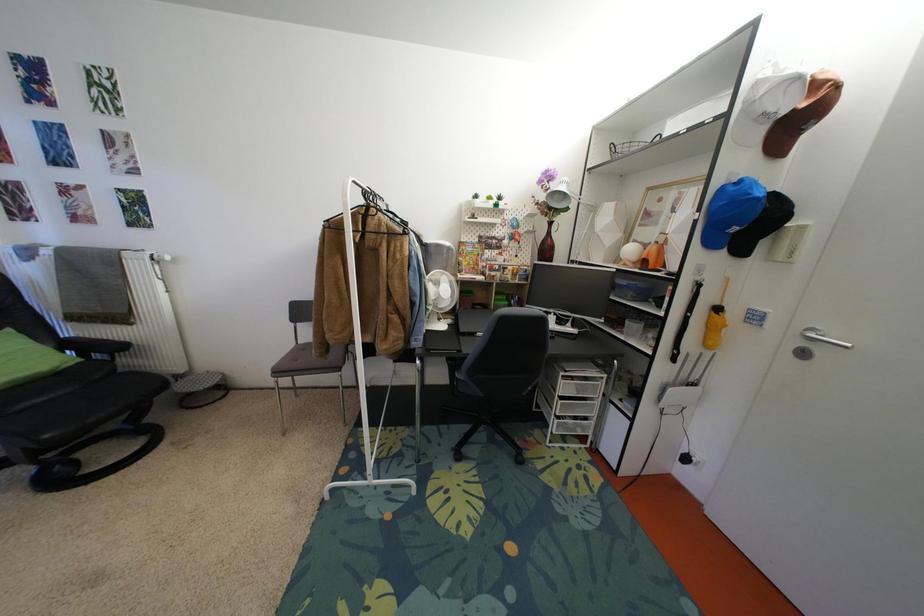
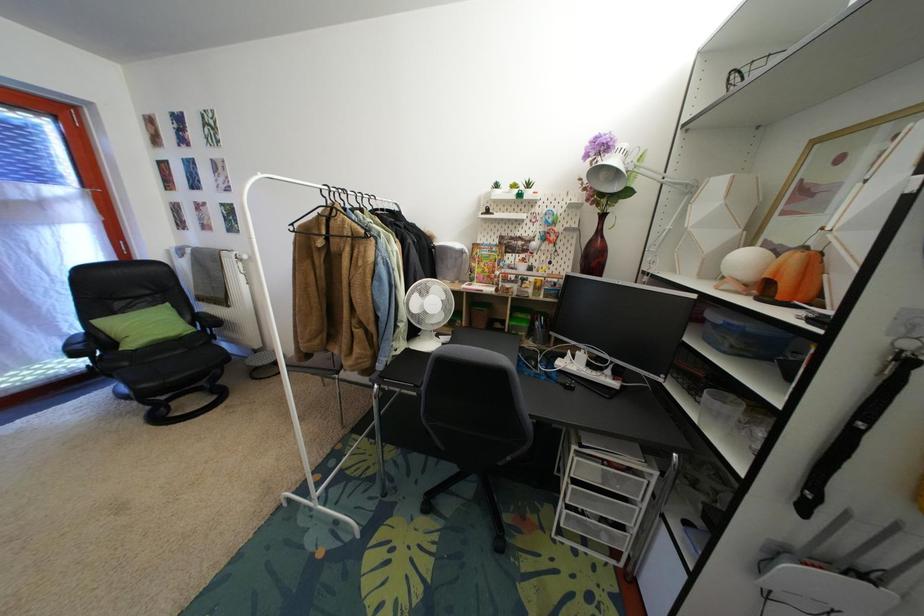
The images are taken continuously from a first-person perspective. In which direction are you moving?

The movement direction of the cameraman is right, forward.